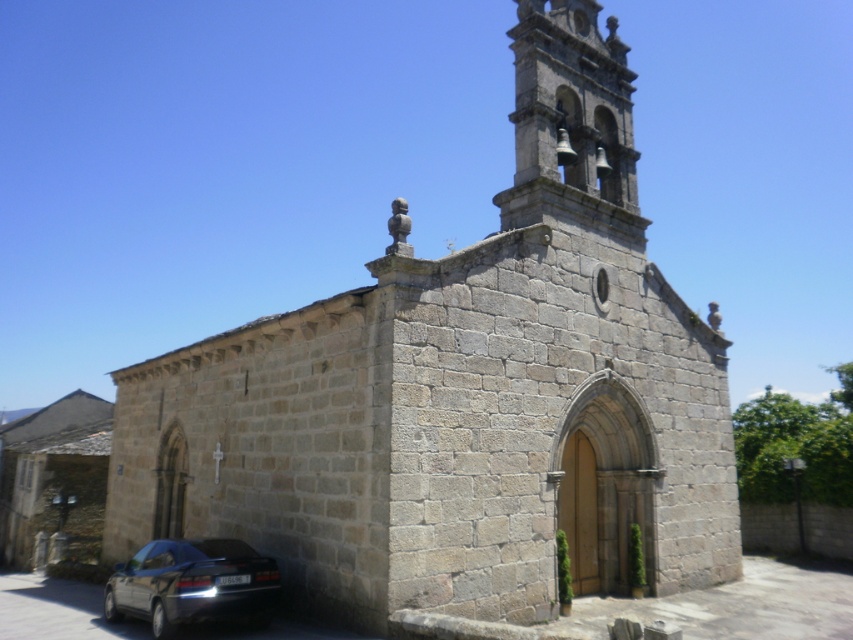
Question: Is gray stone bell tower at upper right below dark gray metallic car at lower left?

Choices:
 (A) yes
 (B) no

Answer: (B)

Question: Where is gray stone bell tower at upper right located in relation to dark gray metallic car at lower left in the image?

Choices:
 (A) above
 (B) below

Answer: (A)

Question: Which point is closer to the camera taking this photo?

Choices:
 (A) (128, 604)
 (B) (527, 116)

Answer: (A)

Question: In this image, where is gray stone bell tower at upper right located relative to dark gray metallic car at lower left?

Choices:
 (A) right
 (B) left

Answer: (A)

Question: Which point is closer to the camera?

Choices:
 (A) [x=196, y=573]
 (B) [x=561, y=19]

Answer: (A)